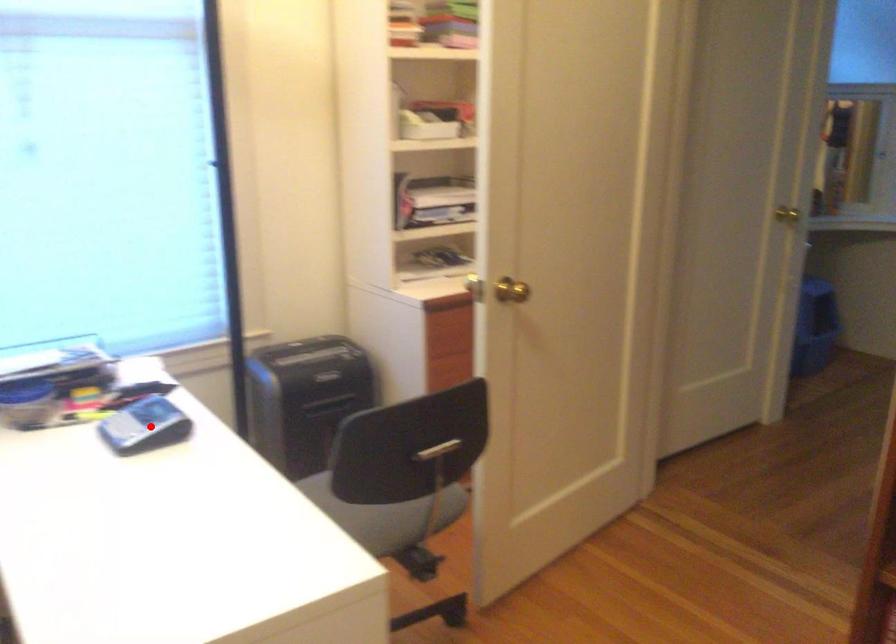
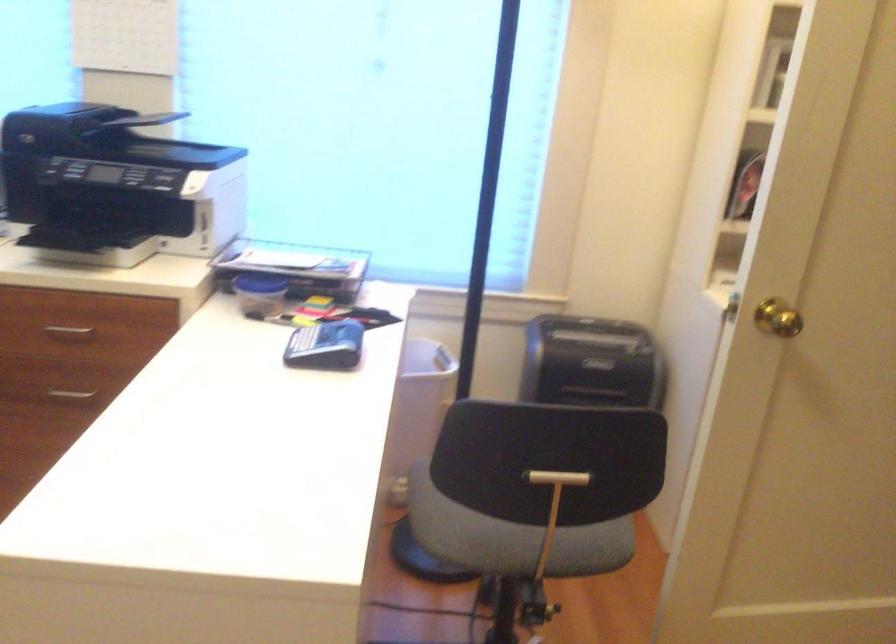
The point at the highlighted location is marked in the first image. Where is the corresponding point in the second image?

(325, 346)